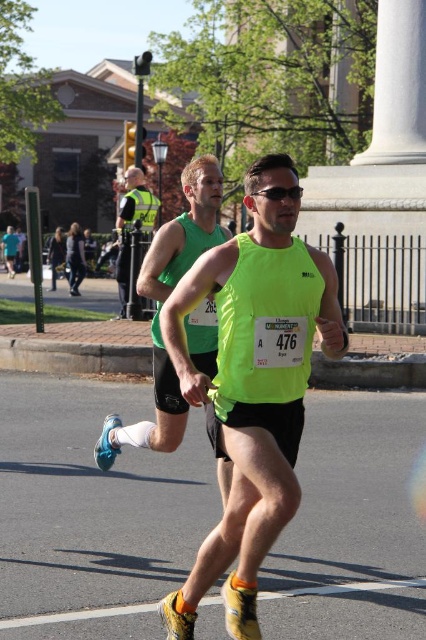
Is neon yellow tank top at center to the right of reflective yellow vest at center from the viewer's perspective?

Yes, neon yellow tank top at center is to the right of reflective yellow vest at center.

Which of these two, neon yellow tank top at center or reflective yellow vest at center, stands shorter?

Standing shorter between the two is neon yellow tank top at center.

Locate an element on the screen. The width and height of the screenshot is (426, 640). neon yellow tank top at center is located at coordinates (253, 384).

This screenshot has height=640, width=426. I want to click on neon yellow tank top at center, so click(253, 384).

From the picture: Does neon yellow tank top at center have a lesser height compared to neon green tank top at center?

No.

Can you confirm if neon yellow tank top at center is positioned below neon green tank top at center?

Yes.

Does point (287, 456) lie in front of point (204, 321)?

Yes, it is.

Where is `neon yellow tank top at center`? neon yellow tank top at center is located at coordinates (253, 384).

From the picture: Who is shorter, neon green tank top at center or reflective yellow vest at center?

neon green tank top at center is shorter.

What do you see at coordinates (161, 307) in the screenshot?
I see `neon green tank top at center` at bounding box center [161, 307].

Identify the location of neon green tank top at center. (161, 307).

Locate an element on the screen. The height and width of the screenshot is (640, 426). neon green tank top at center is located at coordinates (161, 307).